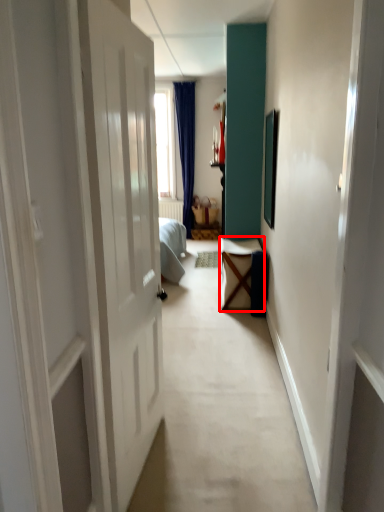
Question: From the image, what is the correct spatial relationship of furniture (annotated by the red box) in relation to furniture?

Choices:
 (A) left
 (B) right

Answer: (B)